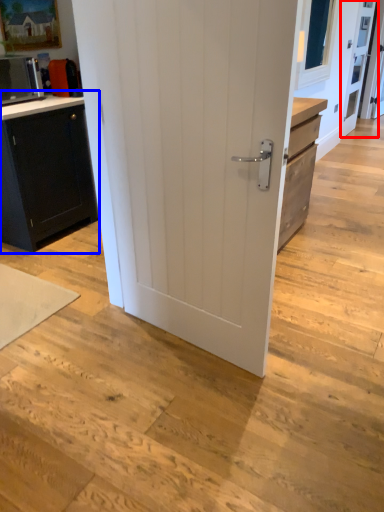
Question: Which object appears closest to the camera in this image, screen door (highlighted by a red box) or cabinetry (highlighted by a blue box)?

Choices:
 (A) screen door
 (B) cabinetry

Answer: (B)